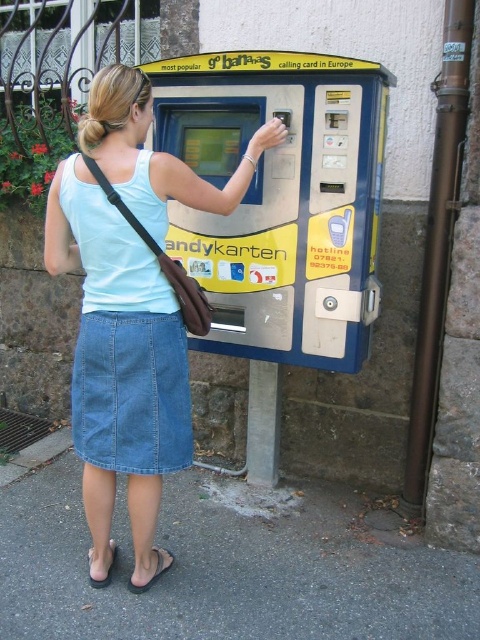
You are standing in a public space and see the yellow plastic vending machine at center and the denim skirt at center. Which object is closer to you?

The yellow plastic vending machine at center is closer to you than the denim skirt at center.